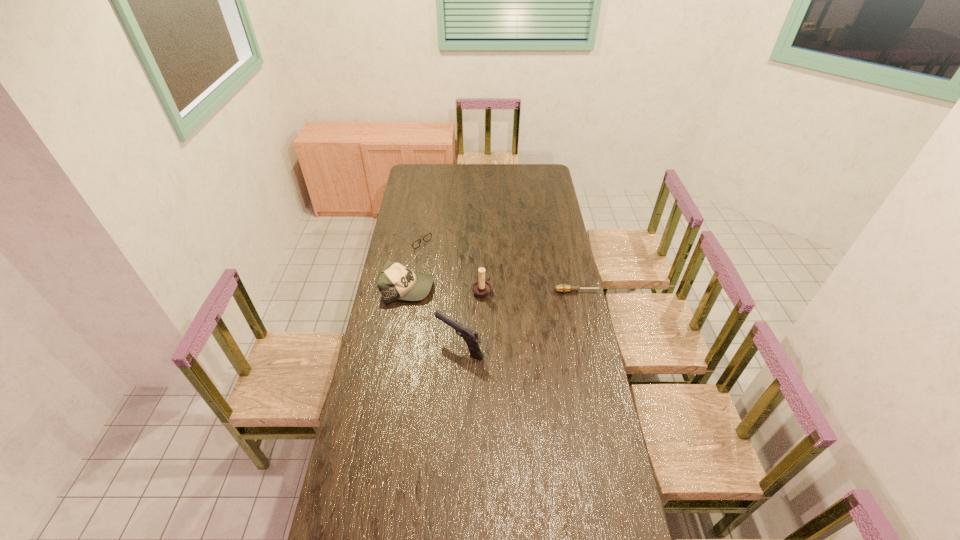
You are a GUI agent. You are given a task and a screenshot of the screen. Output one action in this format:
    pyautogui.click(x=<x>, y=<y>)
    Task: Click on the empty space between the farthest object and the candle holder
    
    Given the screenshot: What is the action you would take?
    pyautogui.click(x=447, y=265)

You are a GUI agent. You are given a task and a screenshot of the screen. Output one action in this format:
    pyautogui.click(x=<x>, y=<y>)
    Task: Click on the free space between the third tallest object and the gun
    
    Given the screenshot: What is the action you would take?
    pyautogui.click(x=434, y=316)

Identify the location of free spot between the third tallest object and the candle holder. The image size is (960, 540). (444, 289).

I want to click on free space between the candle holder and the screwdriver, so click(x=530, y=291).

Identify the location of blank region between the farthest object and the nearest object. Image resolution: width=960 pixels, height=540 pixels. (436, 292).

Where is `vacant space that is in between the shortest object and the candle holder`? This screenshot has width=960, height=540. vacant space that is in between the shortest object and the candle holder is located at coordinates (530, 291).

Image resolution: width=960 pixels, height=540 pixels. Find the location of `free space between the rightmost object and the candle holder`. free space between the rightmost object and the candle holder is located at coordinates (530, 291).

Identify which object is the second nearest to the gun. Please provide its 2D coordinates. Your answer should be formatted as a tuple, i.e. [(x, y)], where the tuple contains the x and y coordinates of a point satisfying the conditions above.

[(481, 288)]

Identify which object is located as the fourth nearest to the shortest object. Please provide its 2D coordinates. Your answer should be formatted as a tuple, i.e. [(x, y)], where the tuple contains the x and y coordinates of a point satisfying the conditions above.

[(426, 238)]

Where is `free space that satisfies the following two spatial constraints: 1. on the front side of the nearest object; 2. at the muzzle of the third tallest object`? This screenshot has width=960, height=540. free space that satisfies the following two spatial constraints: 1. on the front side of the nearest object; 2. at the muzzle of the third tallest object is located at coordinates (398, 346).